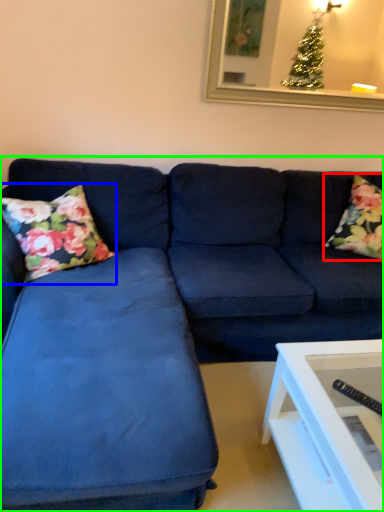
Question: Which object is positioned closest to pillow (highlighted by a red box)? Select from pillow (highlighted by a blue box) and studio couch (highlighted by a green box).

Choices:
 (A) pillow
 (B) studio couch

Answer: (B)